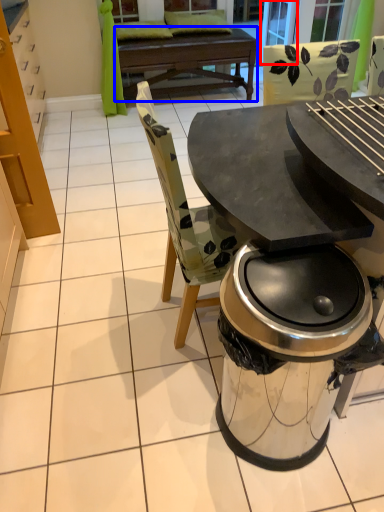
Question: Which object appears closest to the camera in this image, screen door (highlighted by a red box) or round table (highlighted by a blue box)?

Choices:
 (A) screen door
 (B) round table

Answer: (B)